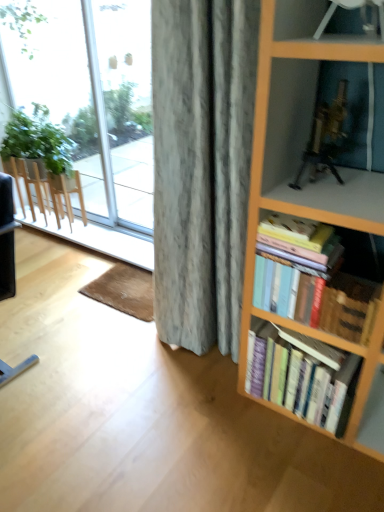
Question: Is transparent glass window at upper left to the left or to the right of metallic gold tripod at upper right in the image?

Choices:
 (A) right
 (B) left

Answer: (B)

Question: Looking at the image, does transparent glass window at upper left seem bigger or smaller compared to metallic gold tripod at upper right?

Choices:
 (A) small
 (B) big

Answer: (B)

Question: Considering the real-world distances, which object is closest to the transparent glass door at left?

Choices:
 (A) hardcover books at right, the 1th book when ordered from bottom to top
 (B) hardcover books at right, the 1th book when ordered from top to bottom
 (C) black leather chair at lower left
 (D) transparent glass window at upper left
 (E) metallic gold tripod at upper right

Answer: (D)

Question: Which object is the closest to the metallic gold tripod at upper right?

Choices:
 (A) transparent glass door at left
 (B) hardcover books at right, the 1th book when ordered from bottom to top
 (C) hardcover books at right, which is the 2th book from bottom to top
 (D) black leather chair at lower left
 (E) transparent glass window at upper left

Answer: (C)